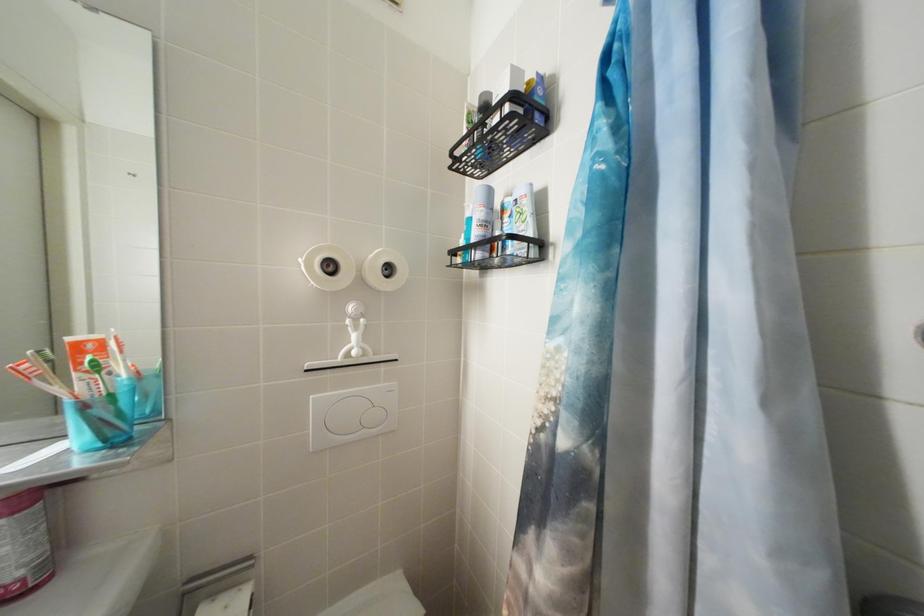
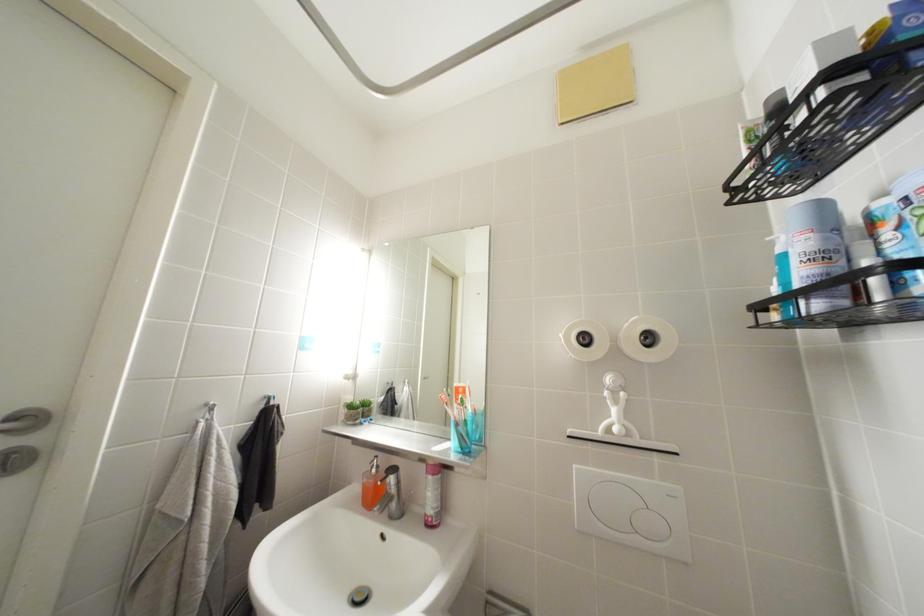
Question: The first image is from the beginning of the video and the second image is from the end. How did the camera likely rotate when shooting the video?

Choices:
 (A) Left
 (B) Right
 (C) Up
 (D) Down

Answer: (A)